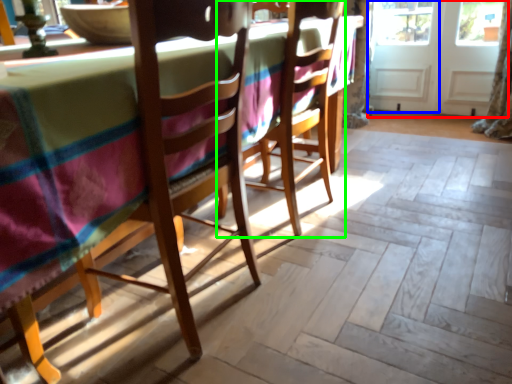
Question: Which object is positioned closest to screen door (highlighted by a red box)? Select from screen door (highlighted by a blue box) and chair (highlighted by a green box).

Choices:
 (A) screen door
 (B) chair

Answer: (A)